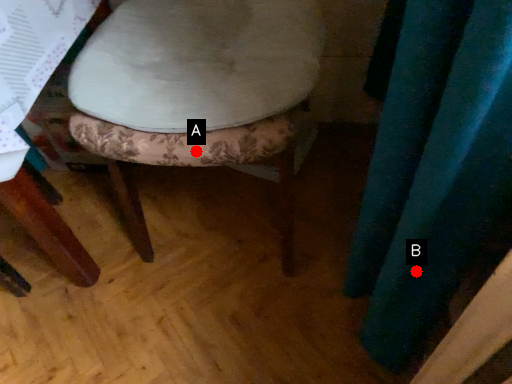
Question: Two points are circled on the image, labeled by A and B beside each circle. Which point is farther from the camera taking this photo?

Choices:
 (A) A is further
 (B) B is further

Answer: (A)